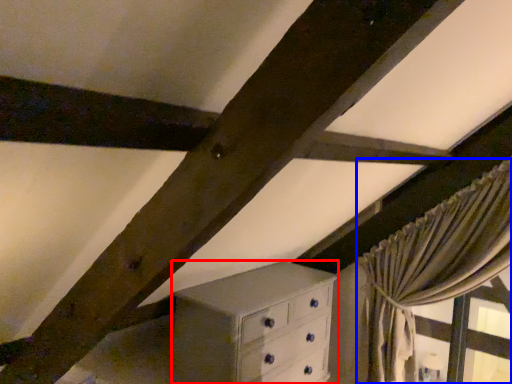
Question: Among these objects, which one is farthest to the camera, chest of drawers (highlighted by a red box) or curtain (highlighted by a blue box)?

Choices:
 (A) chest of drawers
 (B) curtain

Answer: (B)